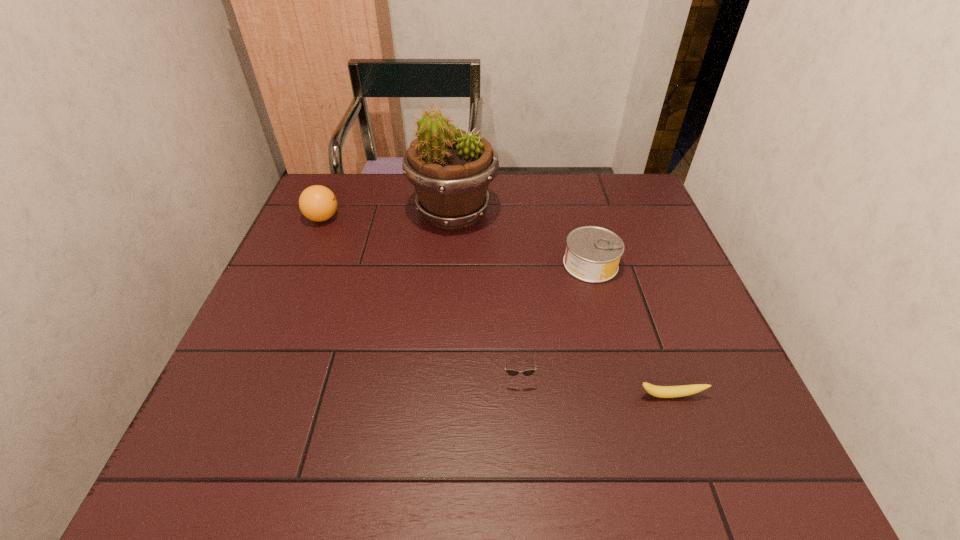
The height and width of the screenshot is (540, 960). I want to click on flowerpot, so click(x=451, y=169).

Where is `the leftmost object`? the leftmost object is located at coordinates (318, 203).

Find the location of a particular element. Image resolution: width=960 pixels, height=540 pixels. the fourth shortest object is located at coordinates (318, 203).

Find the location of a particular element. Image resolution: width=960 pixels, height=540 pixels. the third nearest object is located at coordinates (593, 253).

This screenshot has height=540, width=960. Identify the location of sunglasses. (511, 372).

You are a GUI agent. You are given a task and a screenshot of the screen. Output one action in this format:
    pyautogui.click(x=<x>, y=<y>)
    Task: Click on the banana
    This screenshot has height=540, width=960.
    Given the screenshot: What is the action you would take?
    pyautogui.click(x=685, y=390)

You are a GUI agent. You are given a task and a screenshot of the screen. Output one action in this format:
    pyautogui.click(x=<x>, y=<y>)
    Task: Click on the shortest object
    This screenshot has height=540, width=960.
    Given the screenshot: What is the action you would take?
    (685, 390)

At what (x,y) coordinates should I click in order to perform the action: click on vacant area located 0.060m on the back of the tallest object. Please return your answer as a coordinate pair (x, y). Image resolution: width=960 pixels, height=540 pixels. Looking at the image, I should click on (456, 177).

Where is `vacant space located on the side with brand of the ping-pong ball`? vacant space located on the side with brand of the ping-pong ball is located at coordinates (456, 218).

Locate an element on the screen. free spot located 0.340m on the left of the third nearest object is located at coordinates (432, 264).